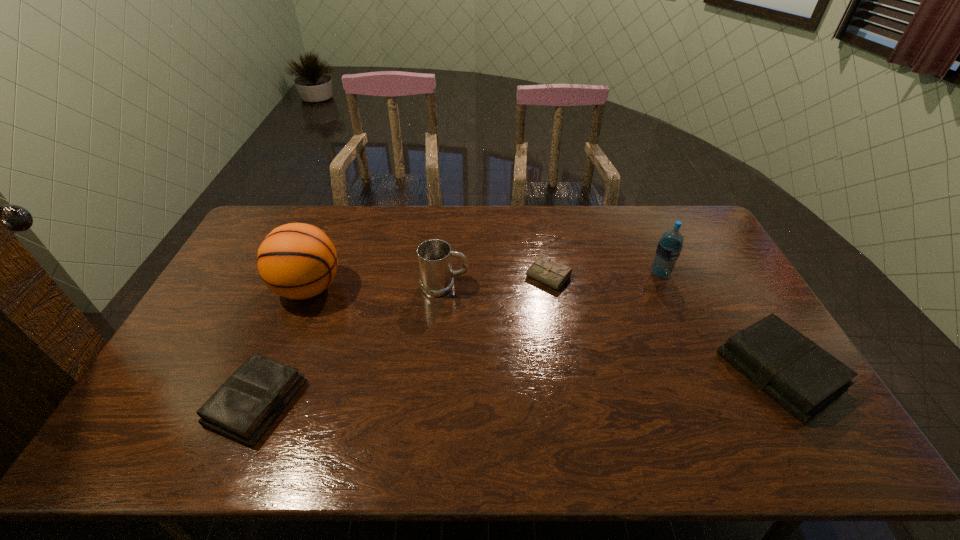
If we want them evenly spaced by inserting an extra book among them, please locate a free spot for this new book. Please provide its 2D coordinates. Your answer should be formatted as a tuple, i.e. [(x, y)], where the tuple contains the x and y coordinates of a point satisfying the conditions above.

[(525, 386)]